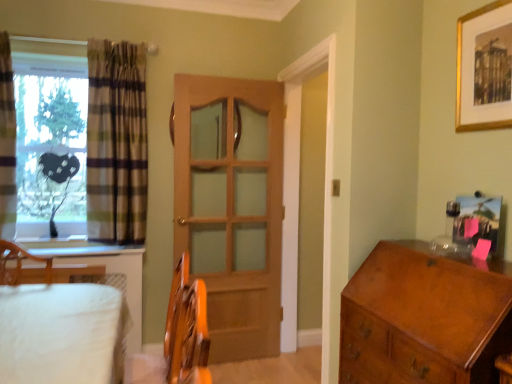
You are a GUI agent. You are given a task and a screenshot of the screen. Output one action in this format:
    pyautogui.click(x=<x>, y=<y>)
    Task: Click on the wooden door at center
    The height and width of the screenshot is (384, 512).
    Given the screenshot: What is the action you would take?
    pyautogui.click(x=232, y=208)

The image size is (512, 384). What do you see at coordinates (51, 150) in the screenshot? I see `transparent plastic heart at left` at bounding box center [51, 150].

Describe the element at coordinates (116, 142) in the screenshot. I see `plaid fabric curtain at left, positioned as the 1th curtain in right-to-left order` at that location.

The image size is (512, 384). I want to click on wooden door at center, so click(232, 208).

From a real-world perspective, does metallic gold picture frame at upper right, which ranks as the first picture frame in bottom-to-top order, sit lower than wooden door at center?

Actually, metallic gold picture frame at upper right, which ranks as the first picture frame in bottom-to-top order, is physically above wooden door at center in the real world.

Is metallic gold picture frame at upper right, which ranks as the first picture frame in bottom-to-top order, closer to camera compared to wooden door at center?

Yes, the depth of metallic gold picture frame at upper right, which ranks as the first picture frame in bottom-to-top order, is less than that of wooden door at center.

Is wooden door at center surrounded by metallic gold picture frame at upper right, arranged as the second picture frame when viewed from the top?

No, wooden door at center is not inside metallic gold picture frame at upper right, arranged as the second picture frame when viewed from the top.

Which is more distant, (x=498, y=225) or (x=269, y=267)?

Point (x=269, y=267)

From the image's perspective, does wooden door at center appear higher than plaid fabric curtain at left, positioned as the second curtain in left-to-right order?

Actually, wooden door at center appears below plaid fabric curtain at left, positioned as the second curtain in left-to-right order, in the image.

Is the depth of wooden door at center less than that of plaid fabric curtain at left, positioned as the 1th curtain in right-to-left order?

No, it is behind plaid fabric curtain at left, positioned as the 1th curtain in right-to-left order.

From a real-world perspective, which is physically above, wooden door at center or plaid fabric curtain at left, positioned as the second curtain in left-to-right order?

From a 3D spatial view, plaid fabric curtain at left, positioned as the second curtain in left-to-right order, is above.

Considering the relative sizes of wooden door at center and plaid fabric curtain at left, positioned as the 1th curtain in right-to-left order, in the image provided, is wooden door at center taller than plaid fabric curtain at left, positioned as the 1th curtain in right-to-left order,?

Yes, wooden door at center is taller than plaid fabric curtain at left, positioned as the 1th curtain in right-to-left order.

Considering the sizes of objects gold metallic picture frame at upper right, the 2th picture frame positioned from the bottom, and transparent plastic heart at left in the image provided, who is wider, gold metallic picture frame at upper right, the 2th picture frame positioned from the bottom, or transparent plastic heart at left?

transparent plastic heart at left.

Is transparent plastic heart at left completely or partially inside gold metallic picture frame at upper right, the 2th picture frame positioned from the bottom?

Definitely not — transparent plastic heart at left is not inside gold metallic picture frame at upper right, the 2th picture frame positioned from the bottom.

From the image's perspective, would you say gold metallic picture frame at upper right, positioned as the first picture frame in top-to-bottom order, is positioned over transparent plastic heart at left?

Yes, from the image's perspective, gold metallic picture frame at upper right, positioned as the first picture frame in top-to-bottom order, is above transparent plastic heart at left.

Is there a large distance between metallic gold picture frame at upper right, arranged as the second picture frame when viewed from the top, and gold metallic picture frame at upper right, positioned as the first picture frame in top-to-bottom order?

No, there isn't a large distance between metallic gold picture frame at upper right, arranged as the second picture frame when viewed from the top, and gold metallic picture frame at upper right, positioned as the first picture frame in top-to-bottom order.

At what (x,y) coordinates should I click in order to perform the action: click on picture frame in front of the metallic gold picture frame at upper right, which ranks as the first picture frame in bottom-to-top order. Please return your answer as a coordinate pair (x, y). This screenshot has height=384, width=512. Looking at the image, I should click on (484, 68).

From the image's perspective, which one is positioned higher, metallic gold picture frame at upper right, arranged as the second picture frame when viewed from the top, or gold metallic picture frame at upper right, positioned as the first picture frame in top-to-bottom order?

gold metallic picture frame at upper right, positioned as the first picture frame in top-to-bottom order.

From the image's perspective, does wooden door at center appear lower than metallic gold picture frame at upper right, which ranks as the first picture frame in bottom-to-top order?

Yes, from the image's perspective, wooden door at center is beneath metallic gold picture frame at upper right, which ranks as the first picture frame in bottom-to-top order.

Which of these two, wooden door at center or metallic gold picture frame at upper right, arranged as the second picture frame when viewed from the top, is smaller?

With smaller size is metallic gold picture frame at upper right, arranged as the second picture frame when viewed from the top.

At what (x,y) coordinates should I click in order to perform the action: click on door beneath the metallic gold picture frame at upper right, which ranks as the first picture frame in bottom-to-top order (from a real-world perspective). Please return your answer as a coordinate pair (x, y). The height and width of the screenshot is (384, 512). Looking at the image, I should click on 232,208.

From a real-world perspective, between shiny brown wooden chest of drawers at right and transparent plastic heart at left, who is vertically lower?

In real-world perspective, shiny brown wooden chest of drawers at right is lower.

Is shiny brown wooden chest of drawers at right to the right of transparent plastic heart at left from the viewer's perspective?

Indeed, shiny brown wooden chest of drawers at right is positioned on the right side of transparent plastic heart at left.

Is the surface of shiny brown wooden chest of drawers at right in direct contact with transparent plastic heart at left?

shiny brown wooden chest of drawers at right and transparent plastic heart at left are not in contact.

Considering the positions of objects shiny brown wooden chest of drawers at right and transparent plastic heart at left in the image provided, who is behind, shiny brown wooden chest of drawers at right or transparent plastic heart at left?

transparent plastic heart at left.

Locate an element on the screen. The height and width of the screenshot is (384, 512). window screen that appears below the plaid fabric curtain at left, positioned as the second curtain in left-to-right order (from a real-world perspective) is located at coordinates coord(51,150).

In the scene shown: From the image's perspective, is transparent plastic heart at left on plaid fabric curtain at left, positioned as the 1th curtain in right-to-left order?

No.

Would you say transparent plastic heart at left is outside plaid fabric curtain at left, positioned as the second curtain in left-to-right order?

Indeed, transparent plastic heart at left is completely outside plaid fabric curtain at left, positioned as the second curtain in left-to-right order.

The image size is (512, 384). In order to click on door that is on the left side of metallic gold picture frame at upper right, which ranks as the first picture frame in bottom-to-top order in this screenshot , I will do coord(232,208).

Locate an element on the screen. Image resolution: width=512 pixels, height=384 pixels. door that is on the right side of plaid fabric curtain at left, positioned as the 1th curtain in right-to-left order is located at coordinates (232, 208).

Estimate the real-world distances between objects in this image. Which object is further from gold metallic picture frame at upper right, the 2th picture frame positioned from the bottom, wooden door at center or shiny brown wooden chest of drawers at right?

wooden door at center is positioned further to the anchor gold metallic picture frame at upper right, the 2th picture frame positioned from the bottom.

Looking at this image, considering their positions, is plaid fabric curtain at left, positioned as the 1th curtain in right-to-left order, positioned further to transparent plastic heart at left than plaid fabric curtain at left, the 1th curtain when ordered from left to right?

The object further to transparent plastic heart at left is plaid fabric curtain at left, positioned as the 1th curtain in right-to-left order.

Consider the image. Considering their positions, is gold metallic picture frame at upper right, positioned as the first picture frame in top-to-bottom order, positioned closer to shiny brown wooden chest of drawers at right than plaid fabric curtain at left, the 1th curtain when ordered from left to right?

Based on the image, gold metallic picture frame at upper right, positioned as the first picture frame in top-to-bottom order, appears to be nearer to shiny brown wooden chest of drawers at right.

Estimate the real-world distances between objects in this image. Which object is further from gold metallic picture frame at upper right, positioned as the first picture frame in top-to-bottom order, plaid fabric curtain at left, positioned as the 1th curtain in right-to-left order, or transparent plastic heart at left?

Based on the image, transparent plastic heart at left appears to be further to gold metallic picture frame at upper right, positioned as the first picture frame in top-to-bottom order.

Estimate the real-world distances between objects in this image. Which object is further from gold metallic picture frame at upper right, the 2th picture frame positioned from the bottom, transparent plastic heart at left or plaid fabric curtain at left, the 1th curtain when ordered from left to right?

plaid fabric curtain at left, the 1th curtain when ordered from left to right, is further to gold metallic picture frame at upper right, the 2th picture frame positioned from the bottom.

When comparing their distances from plaid fabric curtain at left, positioned as the second curtain in right-to-left order, does gold metallic picture frame at upper right, positioned as the first picture frame in top-to-bottom order, or metallic gold picture frame at upper right, which ranks as the first picture frame in bottom-to-top order, seem further?

metallic gold picture frame at upper right, which ranks as the first picture frame in bottom-to-top order, is positioned further to the anchor plaid fabric curtain at left, positioned as the second curtain in right-to-left order.

Looking at this image, looking at the image, which one is located further to plaid fabric curtain at left, positioned as the second curtain in right-to-left order, transparent plastic heart at left or plaid fabric curtain at left, positioned as the second curtain in left-to-right order?

Among the two, plaid fabric curtain at left, positioned as the second curtain in left-to-right order, is located further to plaid fabric curtain at left, positioned as the second curtain in right-to-left order.

Considering their positions, is transparent plastic heart at left positioned closer to plaid fabric curtain at left, positioned as the 1th curtain in right-to-left order, than metallic gold picture frame at upper right, which ranks as the first picture frame in bottom-to-top order?

transparent plastic heart at left is positioned closer to the anchor plaid fabric curtain at left, positioned as the 1th curtain in right-to-left order.

Identify the location of the chest of drawers situated between transparent plastic heart at left and metallic gold picture frame at upper right, arranged as the second picture frame when viewed from the top, from left to right. (424, 317).

Locate an element on the screen. door located between transparent plastic heart at left and shiny brown wooden chest of drawers at right in the left-right direction is located at coordinates click(x=232, y=208).

Identify the location of door situated between plaid fabric curtain at left, the 1th curtain when ordered from left to right, and gold metallic picture frame at upper right, positioned as the first picture frame in top-to-bottom order, from left to right. The image size is (512, 384). (232, 208).

Identify the location of the chest of drawers located between plaid fabric curtain at left, positioned as the second curtain in left-to-right order, and gold metallic picture frame at upper right, the 2th picture frame positioned from the bottom, in the left-right direction. Image resolution: width=512 pixels, height=384 pixels. point(424,317).